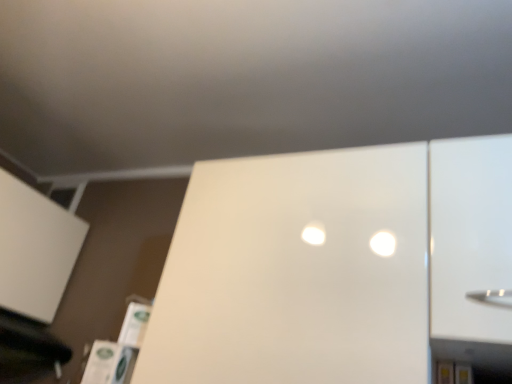
Where is `white glossy cabinet at center`? This screenshot has width=512, height=384. white glossy cabinet at center is located at coordinates (296, 272).

What do you see at coordinates (296, 272) in the screenshot? The width and height of the screenshot is (512, 384). I see `white glossy cabinet at center` at bounding box center [296, 272].

What is the approximate width of white glossy cabinet at center?

white glossy cabinet at center is 13.47 inches in width.

You are a GUI agent. You are given a task and a screenshot of the screen. Output one action in this format:
    pyautogui.click(x=<x>, y=<y>)
    Task: Click on the white glossy cabinet at center
    This screenshot has height=384, width=512.
    Given the screenshot: What is the action you would take?
    pyautogui.click(x=296, y=272)